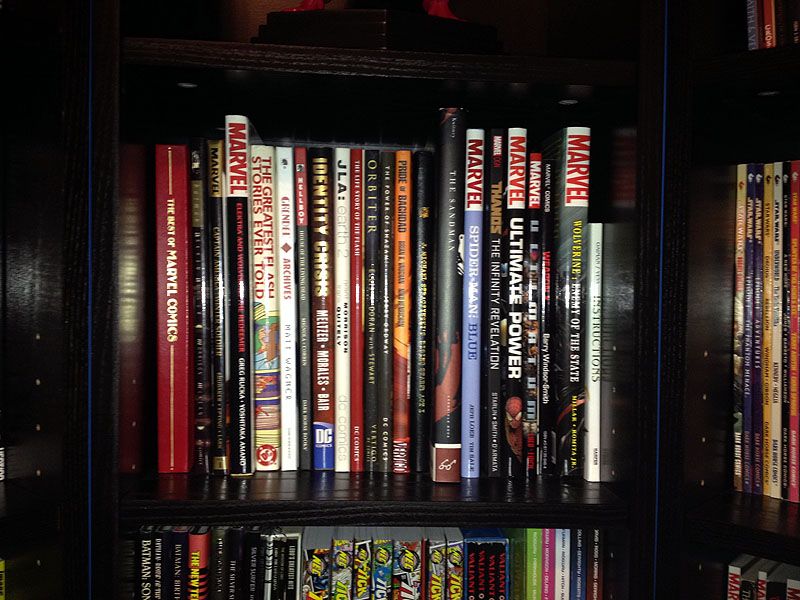
Locate an element on the screen. undersides of shelves is located at coordinates click(342, 94), click(773, 112).